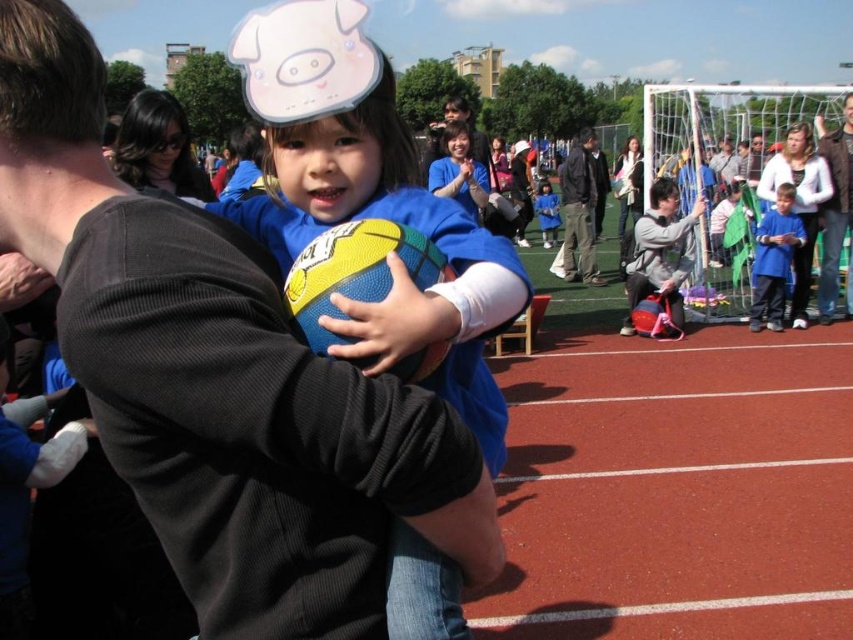
Question: Which object appears farthest from the camera in this image?

Choices:
 (A) matte blue jersey at center
 (B) blue fabric shirt at right

Answer: (B)

Question: Can you confirm if blue fabric shirt at right is bigger than blue fabric shirt at center?

Choices:
 (A) yes
 (B) no

Answer: (B)

Question: Can you confirm if brown leather jacket at upper right is smaller than blue denim jacket at center?

Choices:
 (A) yes
 (B) no

Answer: (A)

Question: Does matte blue jersey at center appear over gray fabric jacket at right?

Choices:
 (A) no
 (B) yes

Answer: (A)

Question: Which object is positioned closest to the dark gray jacket at center?

Choices:
 (A) blue fabric shirt at center
 (B) gray fabric jacket at right
 (C) brown leather jacket at upper right
 (D) blue fabric shirt at right

Answer: (A)

Question: Which of the following is the farthest from the observer?

Choices:
 (A) blue fabric shirt at right
 (B) blue denim jacket at center

Answer: (B)